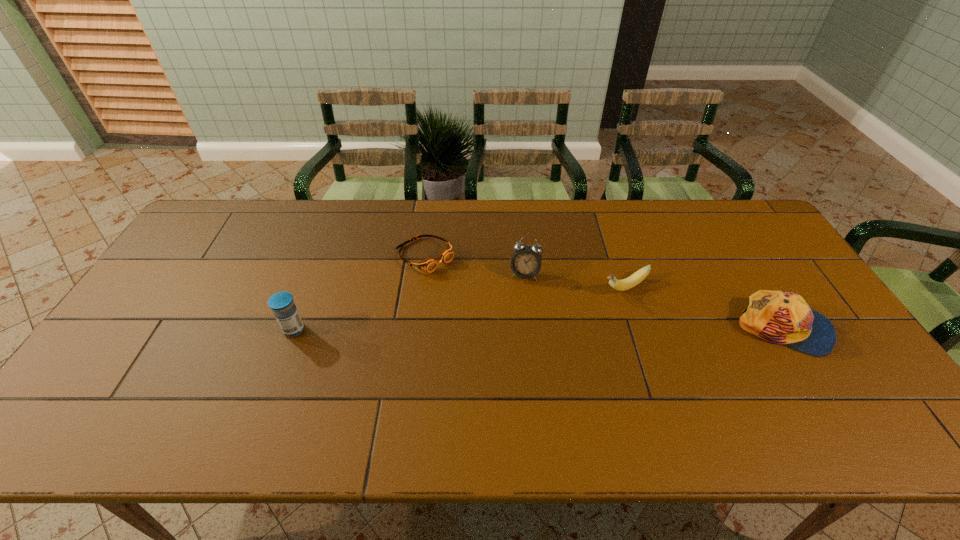
The width and height of the screenshot is (960, 540). I want to click on vacant space at the right edge, so click(780, 266).

In the image, there is a desktop. Identify the location of vacant space at the far left corner. The width and height of the screenshot is (960, 540). (228, 213).

Identify the location of free space at the near left corner of the desktop. The image size is (960, 540). (85, 384).

Identify the location of vacant region at the far right corner of the desktop. The image size is (960, 540). (771, 241).

You are a GUI agent. You are given a task and a screenshot of the screen. Output one action in this format:
    pyautogui.click(x=<x>, y=<y>)
    Task: Click on the vacant space at the near right corner of the desktop
    
    Given the screenshot: What is the action you would take?
    pyautogui.click(x=818, y=381)

Locate an element on the screen. vacant region between the second object from right to left and the alarm clock is located at coordinates (575, 281).

This screenshot has height=540, width=960. I want to click on vacant space that's between the rightmost object and the alarm clock, so click(x=655, y=301).

At what (x,y) coordinates should I click in order to perform the action: click on vacant region between the shortest object and the alarm clock. Please return your answer as a coordinate pair (x, y). Looking at the image, I should click on (475, 265).

Where is `free space between the alarm clock and the medicine`? Image resolution: width=960 pixels, height=540 pixels. free space between the alarm clock and the medicine is located at coordinates (410, 302).

At what (x,y) coordinates should I click in order to perform the action: click on empty space that is in between the goggles and the rightmost object. Please return your answer as a coordinate pair (x, y). The width and height of the screenshot is (960, 540). Looking at the image, I should click on (604, 292).